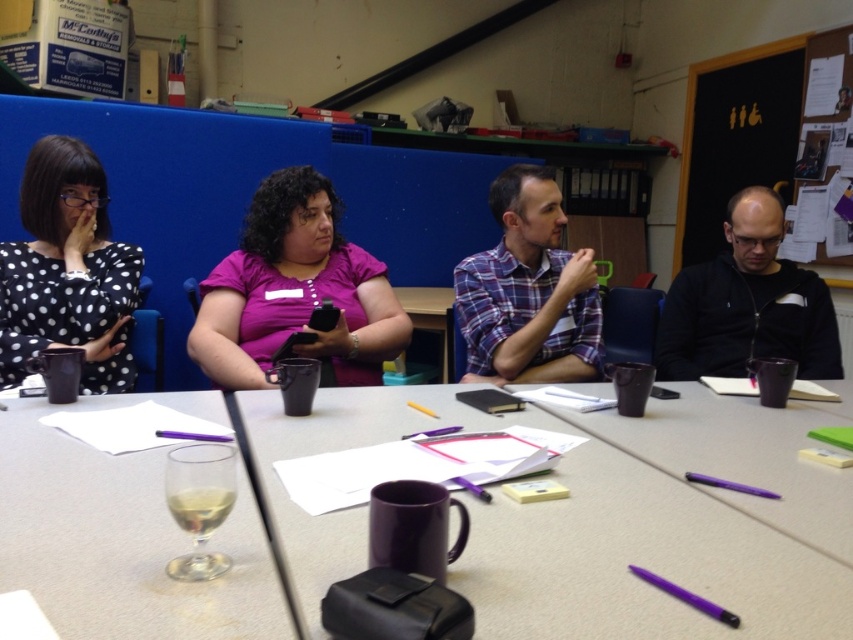
Image resolution: width=853 pixels, height=640 pixels. What do you see at coordinates (294, 291) in the screenshot?
I see `matte pink shirt at center` at bounding box center [294, 291].

Is matte pink shirt at center to the right of purple matte mug at center from the viewer's perspective?

Incorrect, matte pink shirt at center is not on the right side of purple matte mug at center.

Identify the location of matte pink shirt at center. (294, 291).

At what (x,y) coordinates should I click in order to perform the action: click on matte pink shirt at center. Please return your answer as a coordinate pair (x, y). Looking at the image, I should click on (294, 291).

Does point (397, 328) come behind point (10, 356)?

Yes, point (397, 328) is behind point (10, 356).

Between point (360, 369) and point (54, 216), which one is positioned in front?

Point (54, 216) is in front.

Which is in front, point (329, 288) or point (76, 268)?

Point (76, 268) is more forward.

Locate an element on the screen. matte pink shirt at center is located at coordinates (294, 291).

Between clear glass at lower left and black zip-up jacket at right, which one has less height?

clear glass at lower left is shorter.

Can you confirm if clear glass at lower left is thinner than black zip-up jacket at right?

In fact, clear glass at lower left might be wider than black zip-up jacket at right.

Which is in front, point (120, 563) or point (770, 252)?

Point (120, 563) is more forward.

This screenshot has height=640, width=853. I want to click on clear glass at lower left, so click(120, 544).